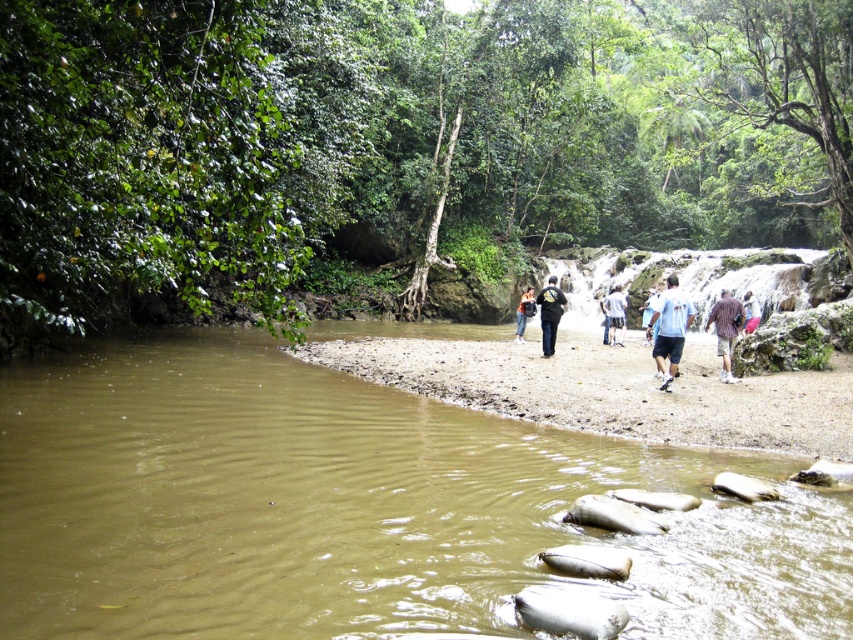
Can you confirm if dark blue jeans at center is wider than white cotton shirt at center?

No.

Can you confirm if dark blue jeans at center is positioned below white cotton shirt at center?

No, dark blue jeans at center is not below white cotton shirt at center.

Is point (554, 284) farther from camera compared to point (607, 310)?

No.

Image resolution: width=853 pixels, height=640 pixels. In order to click on dark blue jeans at center in this screenshot , I will do `click(549, 314)`.

Describe the element at coordinates (397, 147) in the screenshot. I see `green leafy jungle at upper left` at that location.

Does green leafy jungle at upper left have a lesser width compared to blue fabric shirt at center?

Incorrect, green leafy jungle at upper left's width is not less than blue fabric shirt at center's.

Who is more distant from viewer, (370, 99) or (643, 323)?

Positioned behind is point (370, 99).

In order to click on green leafy jungle at upper left in this screenshot , I will do `click(397, 147)`.

Can you confirm if light blue fabric shirt at center is taller than brown cotton shirt at center-right?

Indeed, light blue fabric shirt at center has a greater height compared to brown cotton shirt at center-right.

Locate an element on the screen. The width and height of the screenshot is (853, 640). light blue fabric shirt at center is located at coordinates (670, 330).

In order to click on light blue fabric shirt at center in this screenshot , I will do `click(670, 330)`.